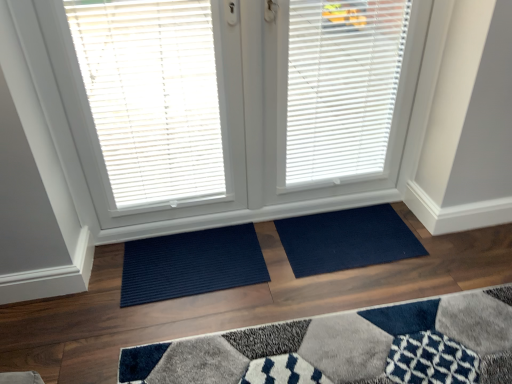
Locate an element on the screen. The height and width of the screenshot is (384, 512). free point above navy blue textured mat at lower center, which is counted as the first doormat, starting from the left (from a real-world perspective) is located at coordinates (188, 252).